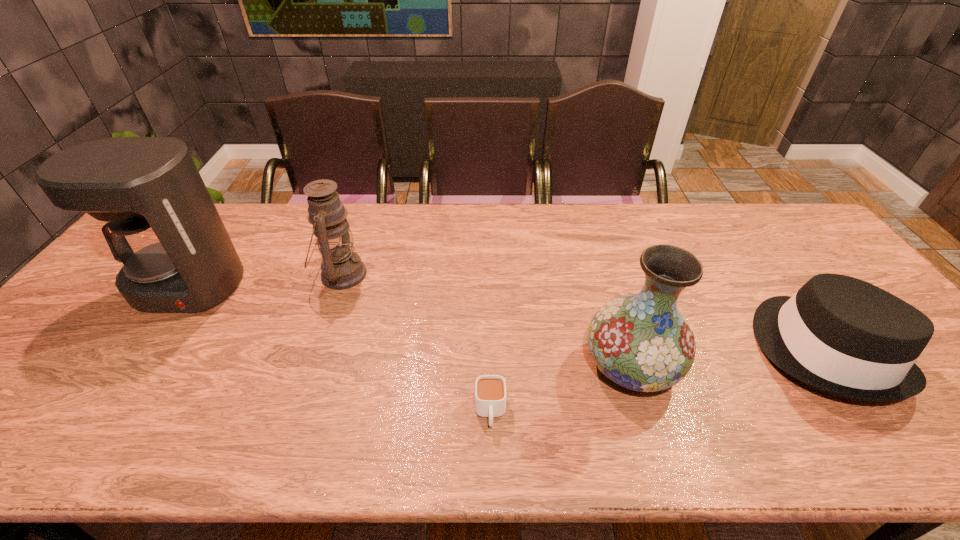
The image size is (960, 540). I want to click on free space between the second object from right to left and the rightmost object, so click(x=728, y=357).

Where is `free area in between the coffee maker and the second object from left to right`? The image size is (960, 540). free area in between the coffee maker and the second object from left to right is located at coordinates (264, 280).

Locate an element on the screen. free point between the oil lamp and the rightmost object is located at coordinates (583, 312).

This screenshot has height=540, width=960. In order to click on empty space that is in between the second object from right to left and the coffee maker in this screenshot , I will do pyautogui.click(x=409, y=326).

I want to click on free space between the leftmost object and the shortest object, so click(x=339, y=349).

Image resolution: width=960 pixels, height=540 pixels. Identify the location of free space between the third object from right to left and the leftmost object. (339, 349).

This screenshot has width=960, height=540. Identify the location of unoccupied position between the tallest object and the cup. (339, 349).

Find the location of a particular element. unoccupied position between the third object from right to left and the vase is located at coordinates (561, 389).

Identify which object is the fourth closest to the vase. Please provide its 2D coordinates. Your answer should be formatted as a tuple, i.e. [(x, y)], where the tuple contains the x and y coordinates of a point satisfying the conditions above.

[(176, 256)]

Point out which object is positioned as the fourth nearest to the rightmost object. Please provide its 2D coordinates. Your answer should be formatted as a tuple, i.e. [(x, y)], where the tuple contains the x and y coordinates of a point satisfying the conditions above.

[(176, 256)]